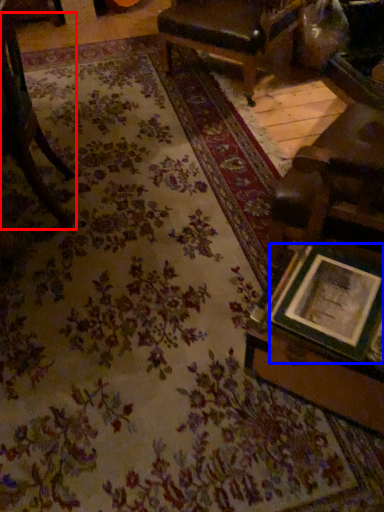
Question: Among these objects, which one is nearest to the camera, chair (highlighted by a red box) or picture frame (highlighted by a blue box)?

Choices:
 (A) chair
 (B) picture frame

Answer: (B)